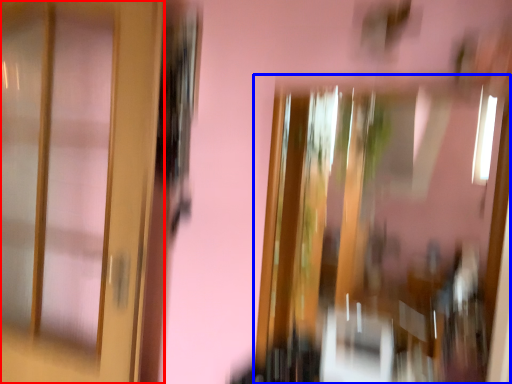
Question: Which object appears closest to the camera in this image, door (highlighted by a red box) or window (highlighted by a blue box)?

Choices:
 (A) door
 (B) window

Answer: (B)